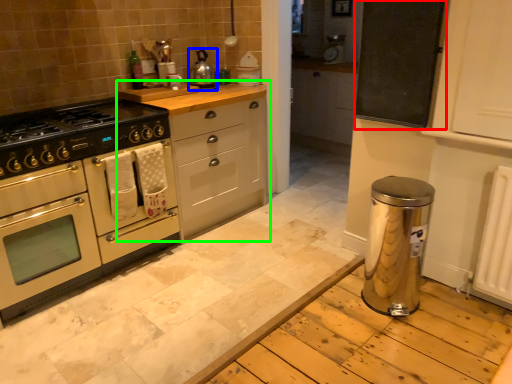
Question: Which object is the closest to the bulletin board (highlighted by a red box)? Choose among these: kitchen appliance (highlighted by a blue box) or cabinetry (highlighted by a green box).

Choices:
 (A) kitchen appliance
 (B) cabinetry

Answer: (B)